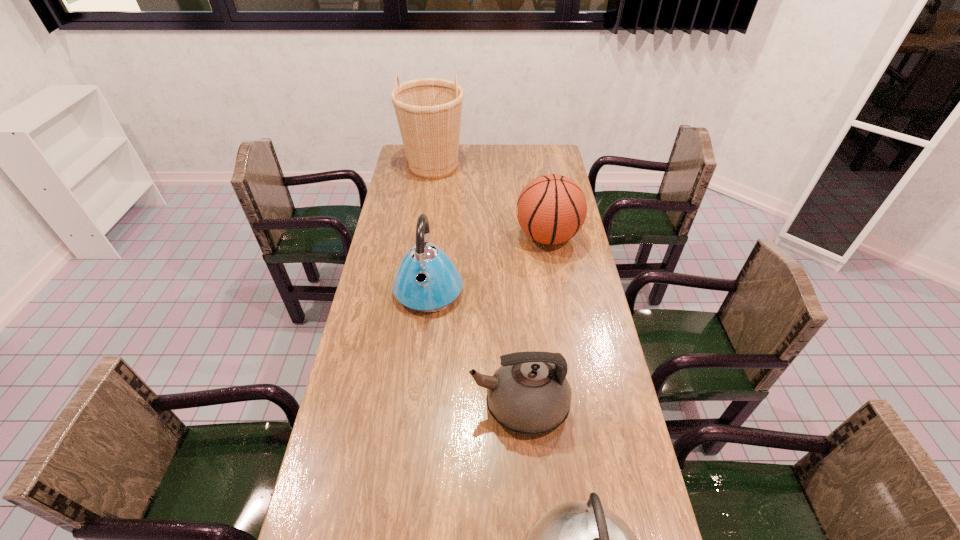
Locate an element on the screen. the tallest object is located at coordinates (428, 110).

Where is `basket`? The height and width of the screenshot is (540, 960). basket is located at coordinates (428, 110).

Locate an element on the screen. The image size is (960, 540). the leftmost kettle is located at coordinates (427, 280).

I want to click on the farthest kettle, so click(427, 280).

Identify the location of basketball. (551, 209).

You are a GUI agent. You are given a task and a screenshot of the screen. Output one action in this format:
    pyautogui.click(x=<x>, y=<y>)
    Task: Click on the fourth farthest object
    
    Given the screenshot: What is the action you would take?
    pyautogui.click(x=529, y=394)

You are a GUI agent. You are given a task and a screenshot of the screen. Output one action in this format:
    pyautogui.click(x=<x>, y=<y>)
    Task: Click on the vacant position located on the front of the basket
    The image size is (960, 540).
    Given the screenshot: What is the action you would take?
    pyautogui.click(x=429, y=196)

You are a GUI agent. You are given a task and a screenshot of the screen. Output one action in this format:
    pyautogui.click(x=<x>, y=<y>)
    Task: Click on the free space located 0.230m at the spout of the leftmost kettle
    The width and height of the screenshot is (960, 540).
    Given the screenshot: What is the action you would take?
    pyautogui.click(x=419, y=379)

Identify the location of free space located on the side where the inflation valve is located. The height and width of the screenshot is (540, 960). (481, 237).

Identify the location of vacant area situated on the side where the inflation valve is located. This screenshot has width=960, height=540. (464, 237).